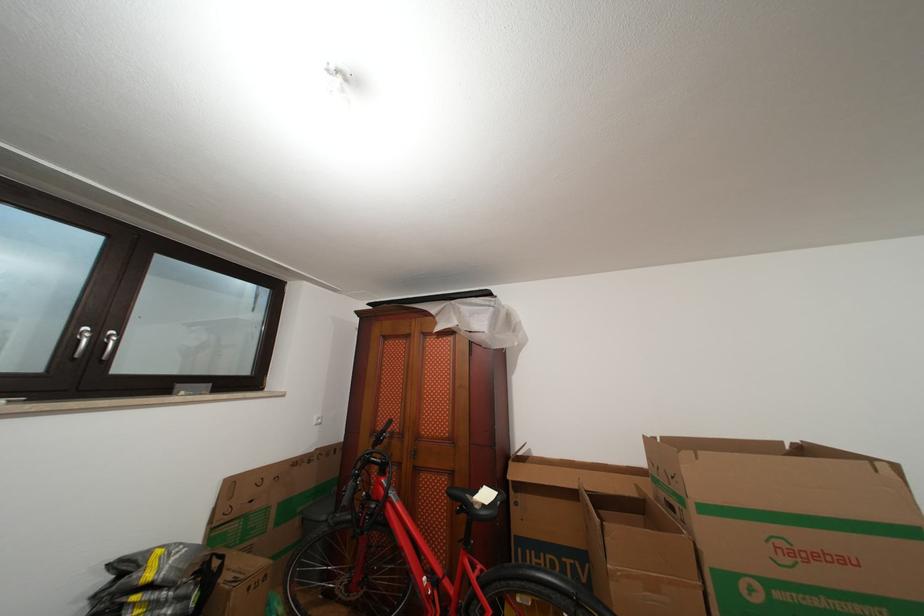
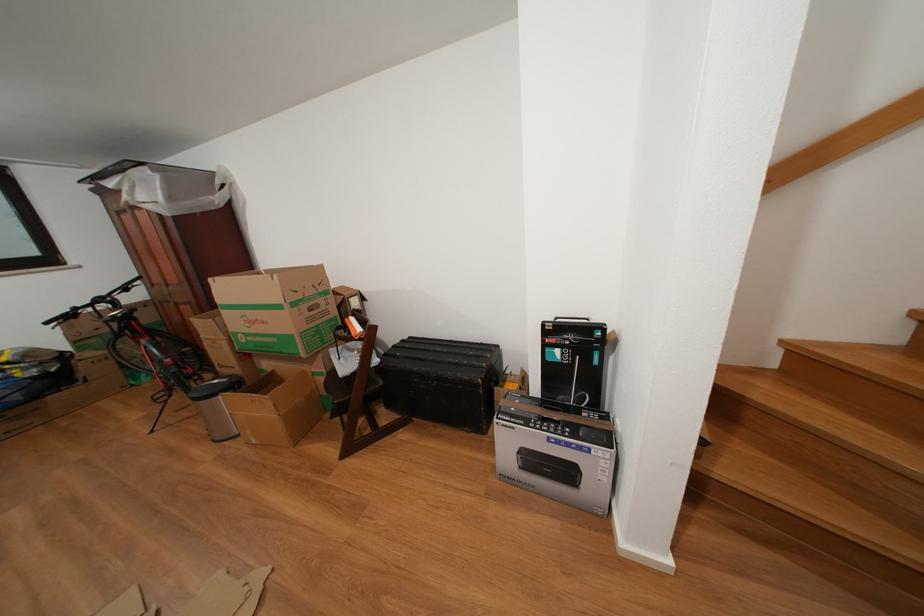
The point at (x=853, y=565) is marked in the first image. Where is the corresponding point in the second image?

(272, 328)